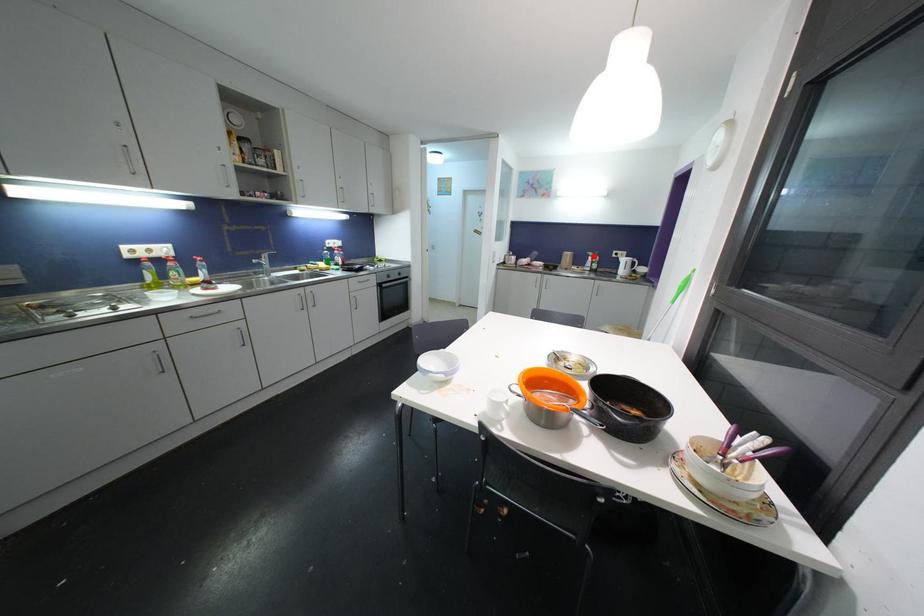
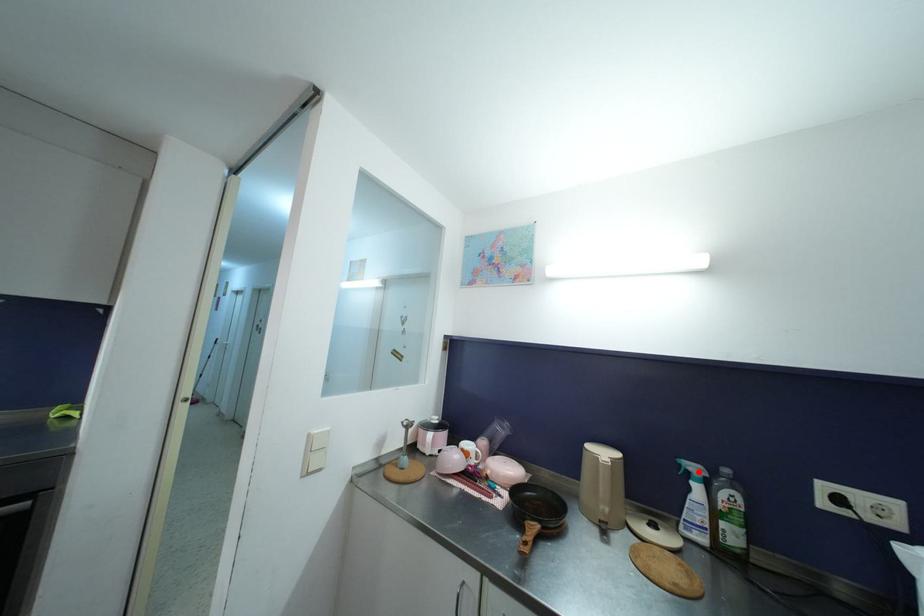
I am providing you with two images of the same scene from different viewpoints. A red point is marked on the first image and another point is marked on the second image. Is the red point in image1 aligned with the point shown in image2?

Yes